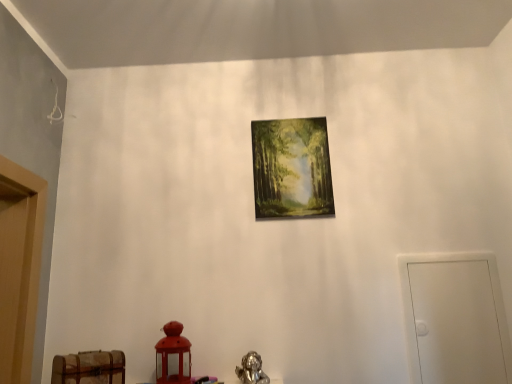
Question: From a real-world perspective, is wooden chest at lower left located beneath matte wooden picture frame at center?

Choices:
 (A) yes
 (B) no

Answer: (A)

Question: Does wooden chest at lower left have a lesser width compared to matte wooden picture frame at center?

Choices:
 (A) yes
 (B) no

Answer: (B)

Question: Could matte wooden picture frame at center be considered to be inside wooden chest at lower left?

Choices:
 (A) no
 (B) yes

Answer: (A)

Question: Is wooden chest at lower left placed right next to matte wooden picture frame at center?

Choices:
 (A) yes
 (B) no

Answer: (B)

Question: From a real-world perspective, is wooden chest at lower left on matte wooden picture frame at center?

Choices:
 (A) yes
 (B) no

Answer: (B)

Question: Considering the relative positions of white matte door at right and wooden chest at lower left in the image provided, is white matte door at right to the left or to the right of wooden chest at lower left?

Choices:
 (A) right
 (B) left

Answer: (A)

Question: Considering the positions of point (468, 294) and point (67, 382), is point (468, 294) closer or farther from the camera than point (67, 382)?

Choices:
 (A) closer
 (B) farther

Answer: (B)

Question: From the image's perspective, is white matte door at right located above or below wooden chest at lower left?

Choices:
 (A) above
 (B) below

Answer: (A)

Question: In terms of size, does white matte door at right appear bigger or smaller than wooden chest at lower left?

Choices:
 (A) small
 (B) big

Answer: (B)

Question: Is wooden chest at lower left in front of or behind white matte door at right in the image?

Choices:
 (A) behind
 (B) front

Answer: (B)

Question: In terms of width, does wooden chest at lower left look wider or thinner when compared to white matte door at right?

Choices:
 (A) wide
 (B) thin

Answer: (A)

Question: From a real-world perspective, is wooden chest at lower left above or below white matte door at right?

Choices:
 (A) above
 (B) below

Answer: (B)

Question: Based on their sizes in the image, would you say wooden chest at lower left is bigger or smaller than white matte door at right?

Choices:
 (A) big
 (B) small

Answer: (B)

Question: Considering the relative positions of white matte door at right and matte wooden picture frame at center in the image provided, is white matte door at right to the left or to the right of matte wooden picture frame at center?

Choices:
 (A) left
 (B) right

Answer: (B)

Question: Is point (421, 314) closer or farther from the camera than point (270, 183)?

Choices:
 (A) farther
 (B) closer

Answer: (B)